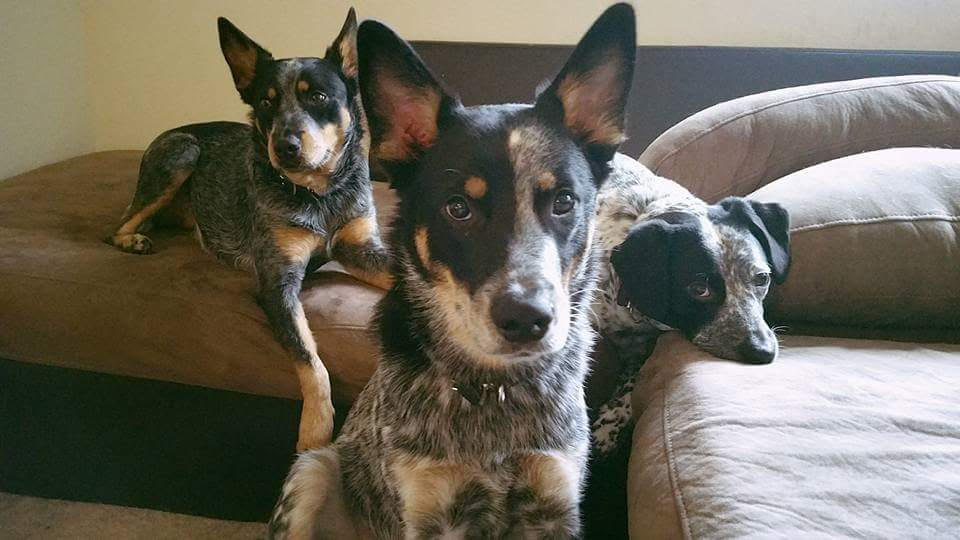
Locate an element on the screen. light brown couch cushion is located at coordinates click(x=55, y=222).